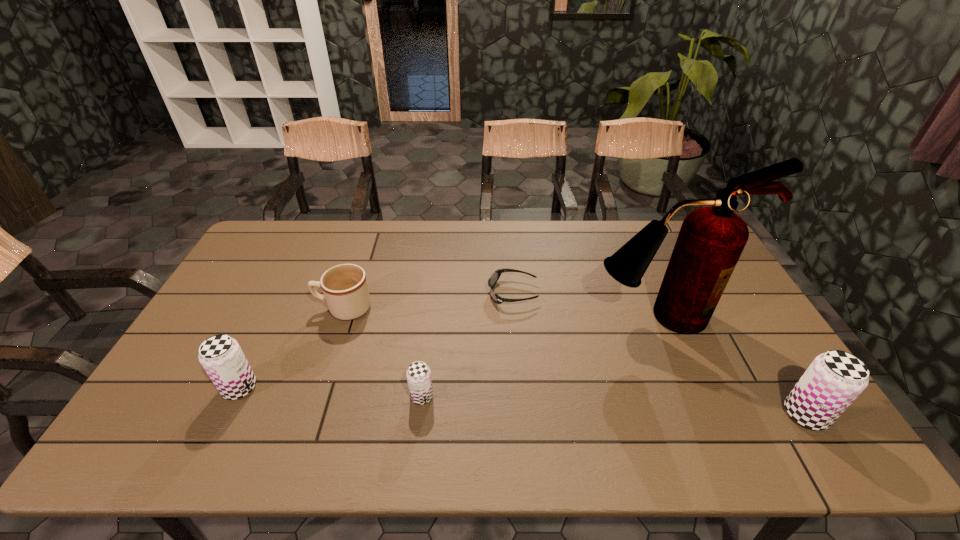
To achieve uniform spacing by inserting another beer_can among them, please point to a free space for this new beer_can. Please provide its 2D coordinates. Your answer should be formatted as a tuple, i.e. [(x, y)], where the tuple contains the x and y coordinates of a point satisfying the conditions above.

[(611, 405)]